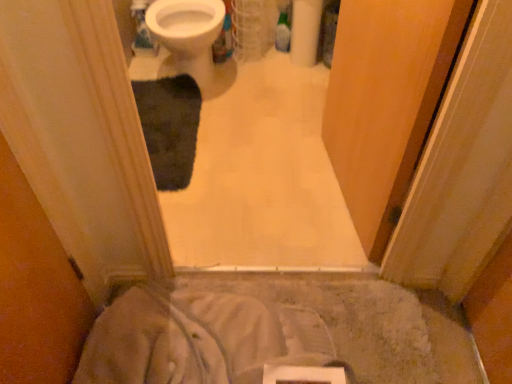
Locate an element on the screen. wooden screen door at center is located at coordinates (386, 102).

Describe the element at coordinates (188, 34) in the screenshot. The height and width of the screenshot is (384, 512). I see `white glossy bidet at upper center` at that location.

This screenshot has height=384, width=512. In order to click on white soft fabric at lower center in this screenshot , I will do `click(200, 339)`.

Would you consider wooden screen door at center to be distant from white soft fabric at lower center?

No, wooden screen door at center is not far away from white soft fabric at lower center.

Could white soft fabric at lower center be considered to be inside wooden screen door at center?

No, white soft fabric at lower center is not inside wooden screen door at center.

Is wooden screen door at center shorter than white soft fabric at lower center?

In fact, wooden screen door at center may be taller than white soft fabric at lower center.

Can you confirm if wooden screen door at center is smaller than dark gray plush bath mat at center?

No, wooden screen door at center is not smaller than dark gray plush bath mat at center.

Is wooden screen door at center in contact with dark gray plush bath mat at center?

There is a gap between wooden screen door at center and dark gray plush bath mat at center.

Is wooden screen door at center looking in the opposite direction of dark gray plush bath mat at center?

wooden screen door at center is not turned away from dark gray plush bath mat at center.

Considering the relative sizes of wooden screen door at center and dark gray plush bath mat at center in the image provided, is wooden screen door at center shorter than dark gray plush bath mat at center?

No, wooden screen door at center is not shorter than dark gray plush bath mat at center.

Considering the positions of point (204, 44) and point (294, 329), is point (204, 44) closer or farther from the camera than point (294, 329)?

Point (204, 44) is farther from the camera than point (294, 329).

Can you confirm if white glossy bidet at upper center is positioned to the right of white soft fabric at lower center?

No.

From a real-world perspective, is white glossy bidet at upper center located beneath white soft fabric at lower center?

Incorrect, from a real-world perspective, white glossy bidet at upper center is higher than white soft fabric at lower center.

Is the depth of white glossy bidet at upper center less than that of dark gray plush bath mat at center?

That is False.

Does white glossy bidet at upper center have a greater width compared to dark gray plush bath mat at center?

Yes.

Is dark gray plush bath mat at center at the back of white glossy bidet at upper center?

No, white glossy bidet at upper center's orientation is not away from dark gray plush bath mat at center.

Where is `bath mat below the white glossy bidet at upper center (from a real-world perspective)`? This screenshot has width=512, height=384. bath mat below the white glossy bidet at upper center (from a real-world perspective) is located at coordinates (169, 127).

From the image's perspective, which object appears higher, dark gray plush bath mat at center or white glossy bidet at upper center?

white glossy bidet at upper center is shown above in the image.

From a real-world perspective, which is physically below, dark gray plush bath mat at center or white glossy bidet at upper center?

dark gray plush bath mat at center, from a real-world perspective.

Is dark gray plush bath mat at center far away from white glossy bidet at upper center?

That's not correct — dark gray plush bath mat at center is a little close to white glossy bidet at upper center.

From a real-world perspective, which is physically below, white soft fabric at lower center or white glossy bidet at upper center?

white soft fabric at lower center.

Are white soft fabric at lower center and white glossy bidet at upper center located far from each other?

Absolutely, white soft fabric at lower center is distant from white glossy bidet at upper center.

Between white soft fabric at lower center and white glossy bidet at upper center, which one has smaller width?

white glossy bidet at upper center is thinner.

Considering the sizes of objects dark gray plush bath mat at center and white soft fabric at lower center in the image provided, who is taller, dark gray plush bath mat at center or white soft fabric at lower center?

With more height is white soft fabric at lower center.

Is dark gray plush bath mat at center turned away from white soft fabric at lower center?

No.

Looking at this image, is there a large distance between dark gray plush bath mat at center and white soft fabric at lower center?

That's not correct — dark gray plush bath mat at center is a little close to white soft fabric at lower center.

Would you say dark gray plush bath mat at center is outside white soft fabric at lower center?

dark gray plush bath mat at center is positioned outside white soft fabric at lower center.

At what (x,y) coordinates should I click in order to perform the action: click on sheet below the wooden screen door at center (from the image's perspective). Please return your answer as a coordinate pair (x, y). This screenshot has height=384, width=512. Looking at the image, I should click on click(200, 339).

You are a GUI agent. You are given a task and a screenshot of the screen. Output one action in this format:
    pyautogui.click(x=<x>, y=<y>)
    Task: Click on the bath mat lying behind the wooden screen door at center
    The width and height of the screenshot is (512, 384).
    Given the screenshot: What is the action you would take?
    pyautogui.click(x=169, y=127)

Looking at the image, which one is located closer to wooden screen door at center, dark gray plush bath mat at center or white soft fabric at lower center?

white soft fabric at lower center is closer to wooden screen door at center.

Based on their spatial positions, is white glossy bidet at upper center or dark gray plush bath mat at center further from wooden screen door at center?

white glossy bidet at upper center lies further to wooden screen door at center than the other object.

From the image, which object appears to be farther from white soft fabric at lower center, white glossy bidet at upper center or dark gray plush bath mat at center?

Among the two, white glossy bidet at upper center is located further to white soft fabric at lower center.

Estimate the real-world distances between objects in this image. Which object is further from white soft fabric at lower center, wooden screen door at center or white glossy bidet at upper center?

Among the two, white glossy bidet at upper center is located further to white soft fabric at lower center.

Based on their spatial positions, is dark gray plush bath mat at center or wooden screen door at center closer to white soft fabric at lower center?

Among the two, wooden screen door at center is located nearer to white soft fabric at lower center.

From the image, which object appears to be farther from white glossy bidet at upper center, dark gray plush bath mat at center or white soft fabric at lower center?

white soft fabric at lower center.

Considering their positions, is white soft fabric at lower center positioned further to white glossy bidet at upper center than dark gray plush bath mat at center?

white soft fabric at lower center lies further to white glossy bidet at upper center than the other object.

Looking at the image, which one is located further to wooden screen door at center, white glossy bidet at upper center or white soft fabric at lower center?

white glossy bidet at upper center is further to wooden screen door at center.

Image resolution: width=512 pixels, height=384 pixels. I want to click on screen door between white glossy bidet at upper center and white soft fabric at lower center vertically, so click(386, 102).

Identify the location of bath mat between white glossy bidet at upper center and white soft fabric at lower center from top to bottom. (169, 127).

The image size is (512, 384). Find the location of `bath mat between wooden screen door at center and white glossy bidet at upper center along the z-axis`. bath mat between wooden screen door at center and white glossy bidet at upper center along the z-axis is located at coordinates (169, 127).

Where is `sheet between wooden screen door at center and dark gray plush bath mat at center from front to back`? The width and height of the screenshot is (512, 384). sheet between wooden screen door at center and dark gray plush bath mat at center from front to back is located at coordinates (200, 339).